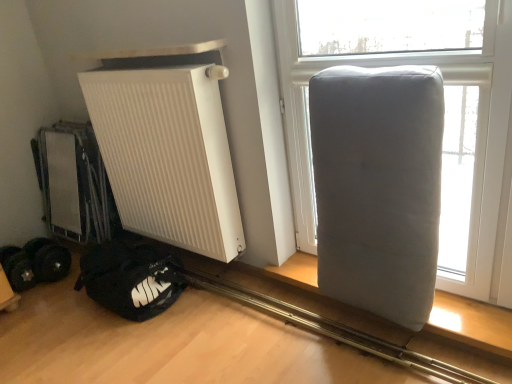
The height and width of the screenshot is (384, 512). What are the coordinates of `vacant area that is in front of black fabric sleeping bag at lower left` in the screenshot? It's located at (108, 346).